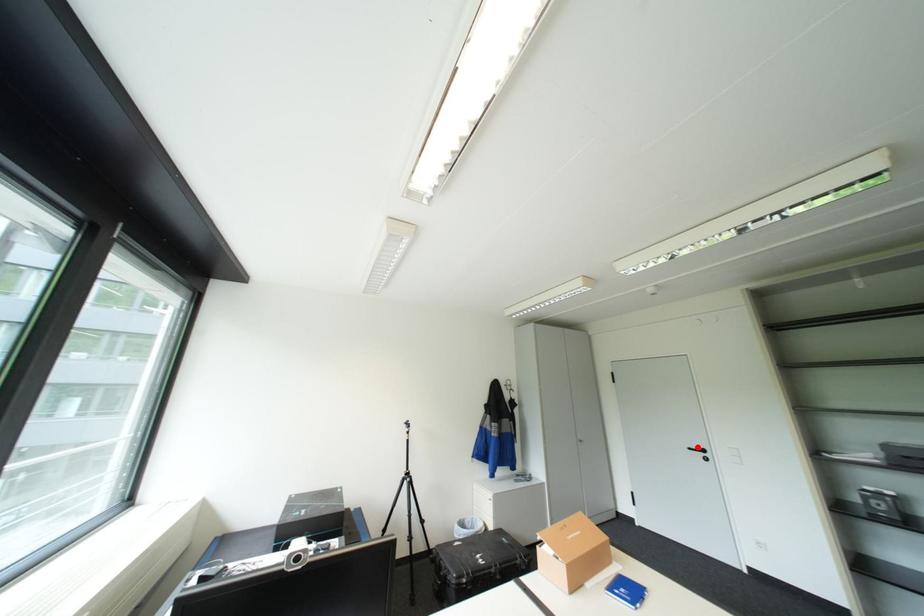
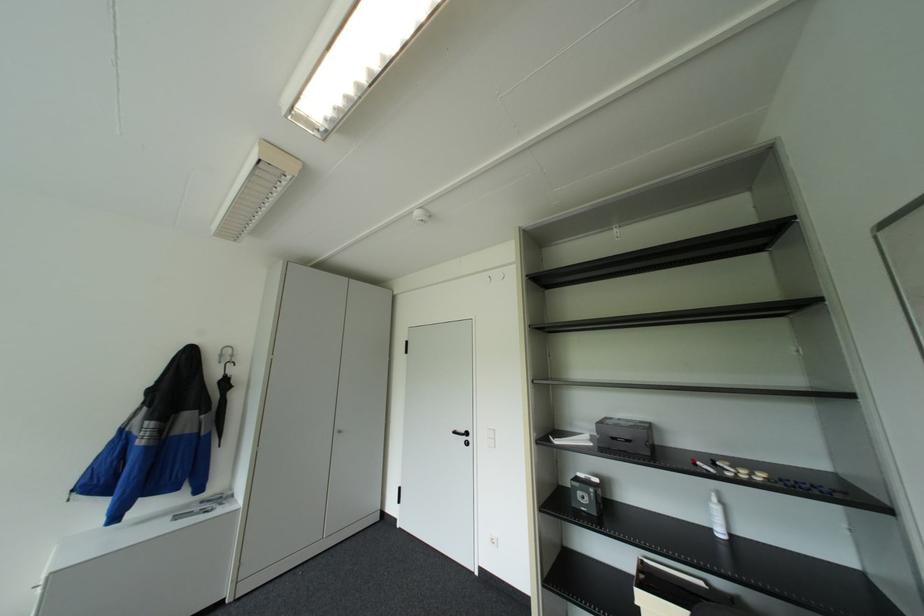
The point at the highlighted location is marked in the first image. Where is the corresponding point in the second image?

(463, 431)